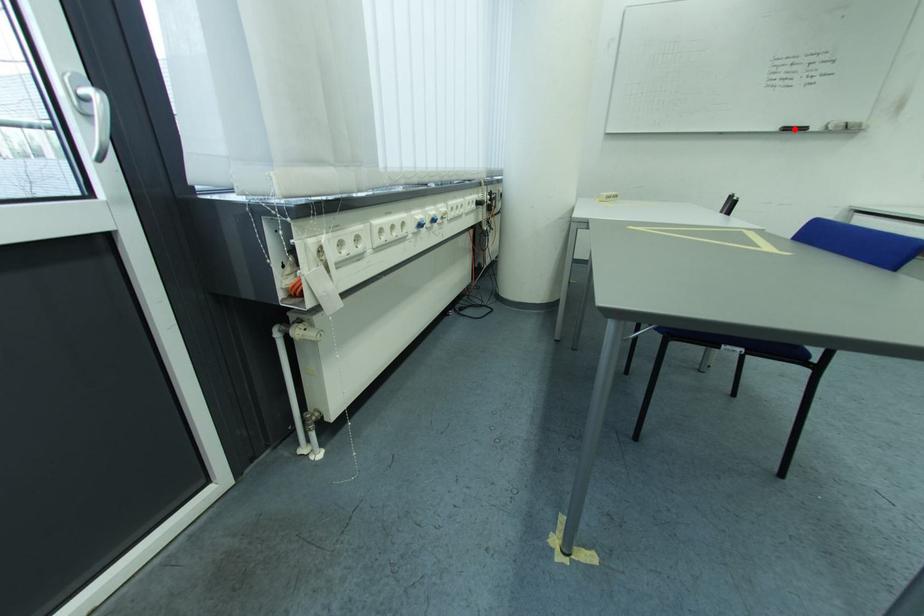
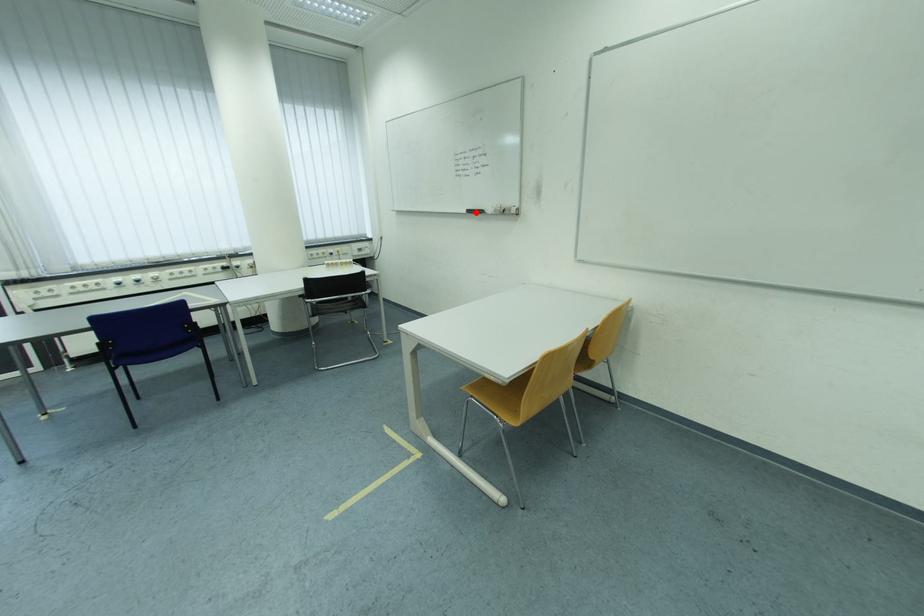
I am providing you with two images of the same scene from different viewpoints. A red point is marked on the first image and another point is marked on the second image. Do the highlighted points in image1 and image2 indicate the same real-world spot?

Yes